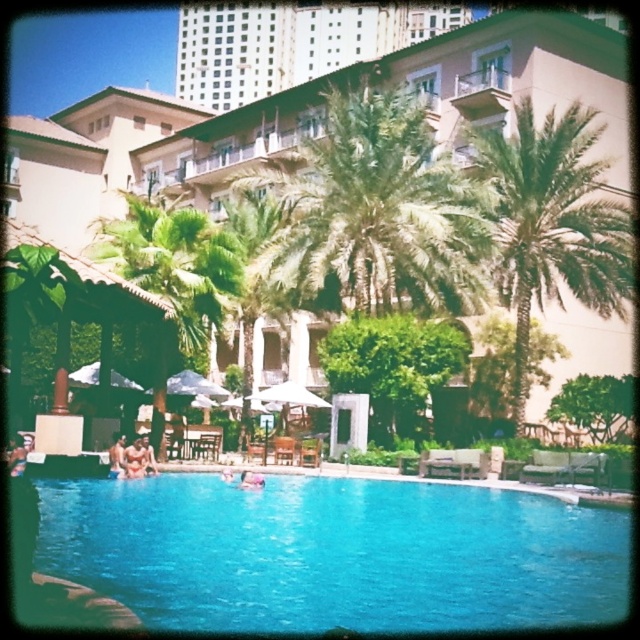
Based on the photo, you are standing at the edge of the swimming pool and want to reach a point closer to you. Which point should you head towards, point (54, 490) or point (92, 102)?

Point (54, 490) is closer to the viewer than point (92, 102), so you should head towards point (54, 490).

You are standing at the edge of the swimming pool and see two points marked in the image. One is at point (429, 260) and the other at point (124, 470). Which point is closer to you?

Point (124, 470) is closer to you because it is nearer to the camera compared to point (429, 260), which is further away.

You are a drone operator tasked with capturing aerial footage of the blue glassy swimming pool at center and the green leafy palm tree at right. The minimum safe distance between the drone and any object is 5 meters. Can you fly the drone directly between them without violating the safety distance?

The blue glassy swimming pool at center is 21.61 meters from the green leafy palm tree at right. Since the minimum safe distance is 5 meters, the drone can safely fly between them as the distance between the two objects exceeds the required safety margin.